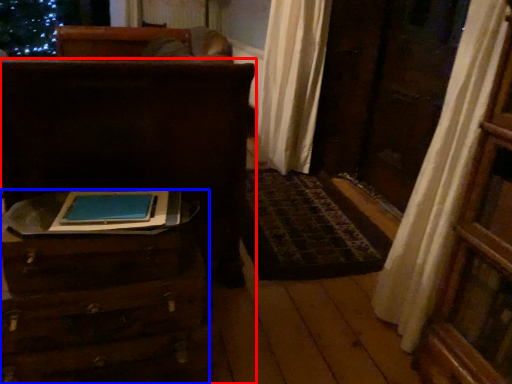
Question: Which of the following is the farthest to the observer, furniture (highlighted by a red box) or furniture (highlighted by a blue box)?

Choices:
 (A) furniture
 (B) furniture

Answer: (A)